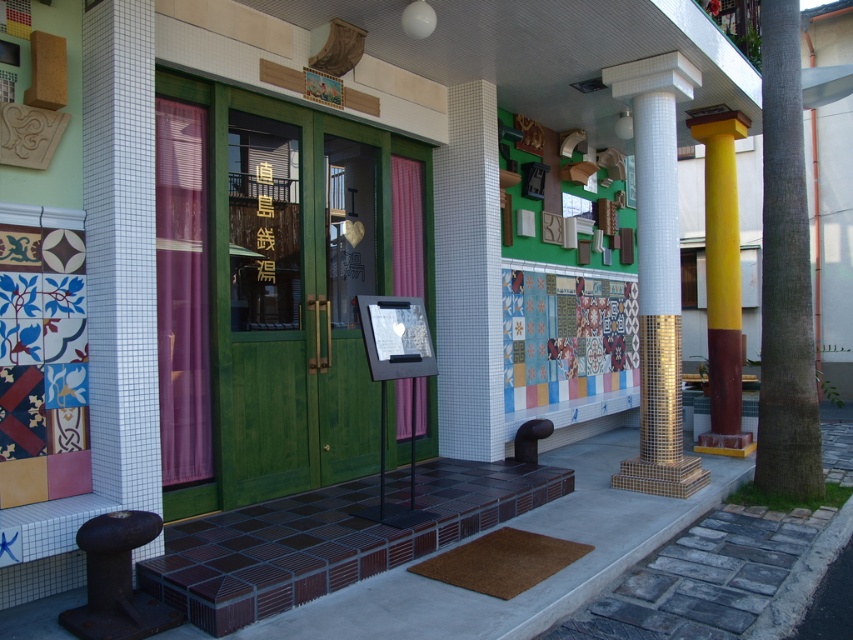
You are a visitor at the entrance of this building and need to enter. The green matte wood door at center is the entrance. However, you have a tall ladder that is 2.5 meters in height. Can you carry the ladder through the entrance without hitting the yellow mosaic column at right?

The green matte wood door at center is not as tall as the yellow mosaic column at right, but the height of the door itself is not provided. Therefore, it is uncertain whether the ladder can pass through without hitting the column. You should check the door height before attempting to carry the ladder through.

You are a delivery person with a cart that is 5 feet wide. You need to move your cart through the entrance area. Is there enough space between the brown brick pavement at lower center and the white mosaic pillar at center to maneuver your cart?

The distance between the brown brick pavement at lower center and the white mosaic pillar at center is 5.38 feet, which is wider than the cart width of 5 feet. Therefore, there is sufficient space to maneuver the cart between them.